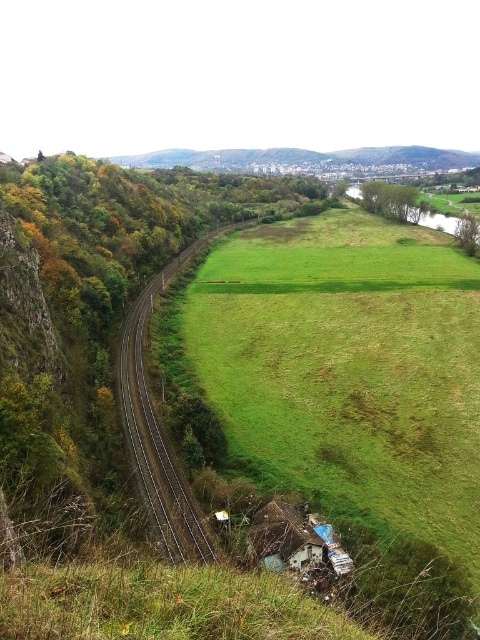
You are a gardener planning to mow the green grassy field at center and the metallic tracks at center. Which area requires a wider mower to cover its entire width?

The green grassy field at center requires a wider mower because its width is larger than the metallic tracks at center.

You are standing at the point marked by coordinates (x=348, y=371) in the rural landscape. Based on the scene description, what type of terrain are you most likely standing on?

The point (x=348, y=371) corresponds to the green grassy field at center, so you are most likely standing on a green grassy field.

Looking at this image, you are a train engineer approaching the curve in the railway track. You notice the green grassy field at center and the metallic tracks at center. Which object is positioned to the right side from your perspective?

The green grassy field at center is to the right of the metallic tracks at center, so from the train engineer perspective, the green grassy field at center is positioned to the right side.